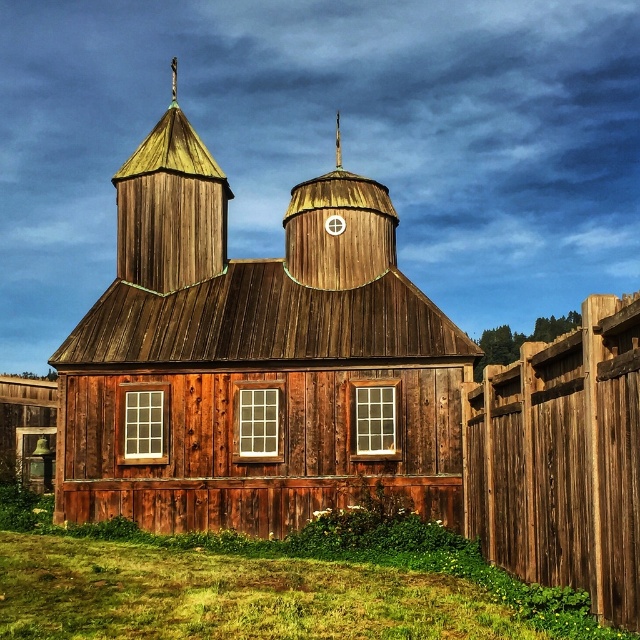
Question: Which of the following is the farthest from the observer?

Choices:
 (A) (323, 285)
 (B) (65, 340)

Answer: (B)

Question: Does wooden chapel at center have a lesser width compared to wooden shingles spire at upper left?

Choices:
 (A) yes
 (B) no

Answer: (B)

Question: Is wooden chapel at center closer to the viewer compared to gold textured spire at upper center?

Choices:
 (A) yes
 (B) no

Answer: (A)

Question: Based on their relative distances, which object is nearer to the wooden spire at center?

Choices:
 (A) wooden chapel at center
 (B) wooden shingles spire at upper left
 (C) brown wooden fence at right
 (D) gold textured spire at upper center

Answer: (A)

Question: Is wooden spire at center to the right of gold textured spire at upper center from the viewer's perspective?

Choices:
 (A) yes
 (B) no

Answer: (B)

Question: Which object is positioned farthest from the brown wooden fence at right?

Choices:
 (A) wooden chapel at center
 (B) gold textured spire at upper center

Answer: (B)